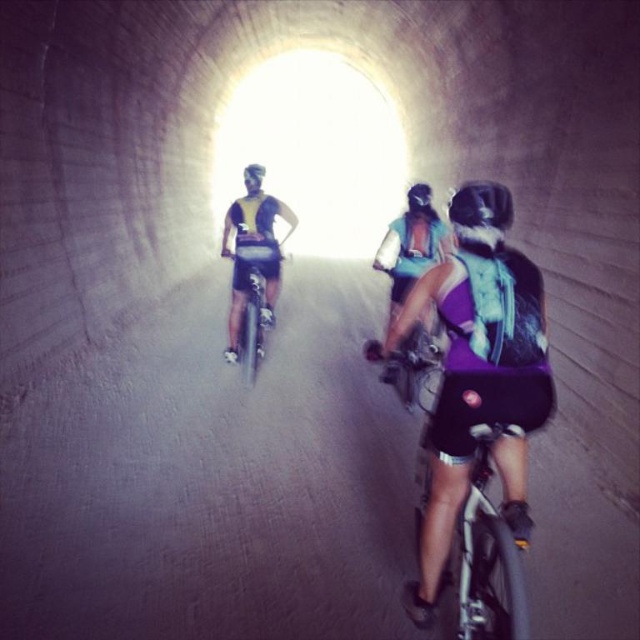
You are a cyclist in the tunnel and you need to reach your bag quickly. Which item is located lower down between the purple fabric bag at center and the purple fabric shorts at center?

The purple fabric bag at center is located below the purple fabric shorts at center, so the bag is lower down.

You are a cyclist approaching the tunnel entrance. You notice a purple fabric bag at center and a matte black helmet at center in the tunnel. Which object is closer to you as you enter the tunnel?

The purple fabric bag at center is closer to you because it is positioned in front of the matte black helmet at center.